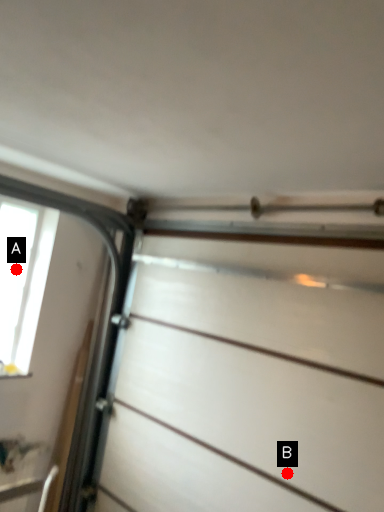
Question: Two points are circled on the image, labeled by A and B beside each circle. Which point is farther from the camera taking this photo?

Choices:
 (A) A is further
 (B) B is further

Answer: (A)